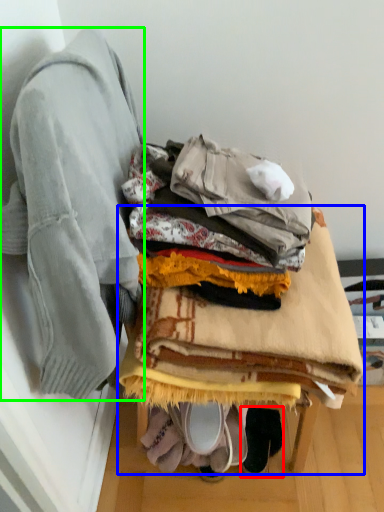
Question: Based on their relative distances, which object is nearer to footwear (highlighted by a red box)? Choose from furniture (highlighted by a blue box) and jacket (highlighted by a green box).

Choices:
 (A) furniture
 (B) jacket

Answer: (A)